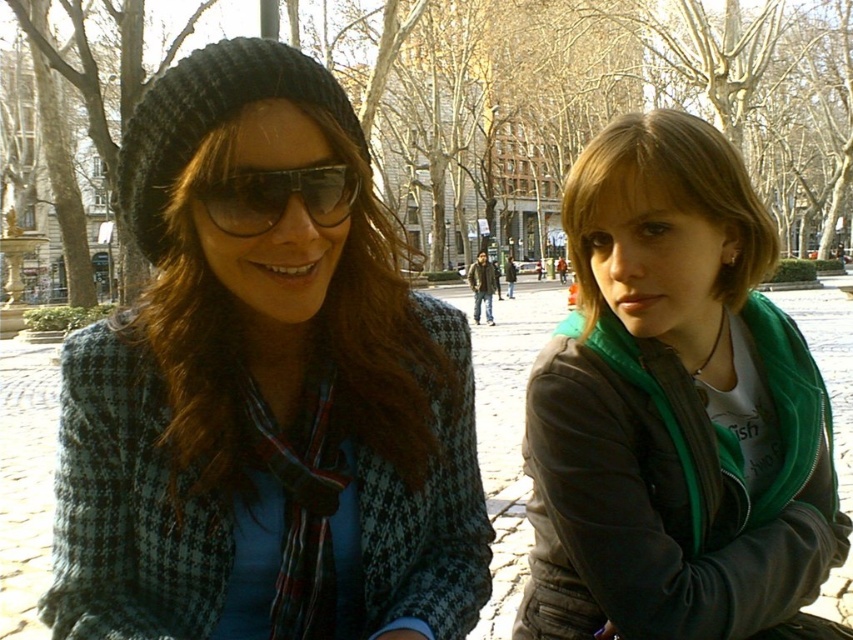
Question: Does houndstooth fabric coat at center have a smaller size compared to black reflective sunglasses at center?

Choices:
 (A) no
 (B) yes

Answer: (A)

Question: Which object is the farthest from the green matte scarf at center?

Choices:
 (A) houndstooth fabric coat at center
 (B) black reflective sunglasses at center

Answer: (B)

Question: Is green matte scarf at center to the right of black reflective sunglasses at center from the viewer's perspective?

Choices:
 (A) yes
 (B) no

Answer: (A)

Question: Which of the following is the farthest from the observer?

Choices:
 (A) green matte scarf at center
 (B) black reflective sunglasses at center
 (C) houndstooth fabric coat at center

Answer: (A)

Question: Which point appears closest to the camera in this image?

Choices:
 (A) (248, 172)
 (B) (167, 490)
 (C) (676, 321)

Answer: (A)

Question: Where is houndstooth fabric coat at center located in relation to green matte scarf at center in the image?

Choices:
 (A) left
 (B) right

Answer: (A)